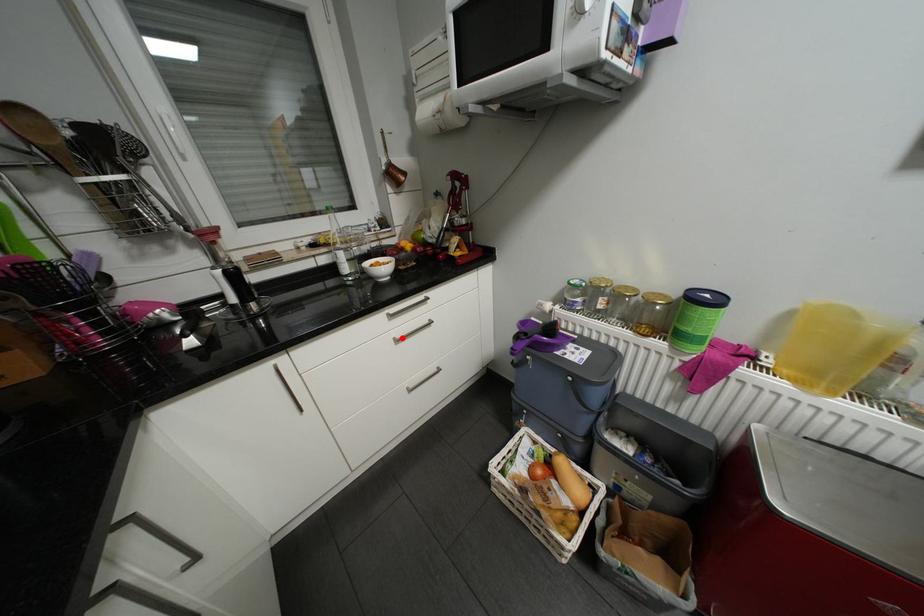
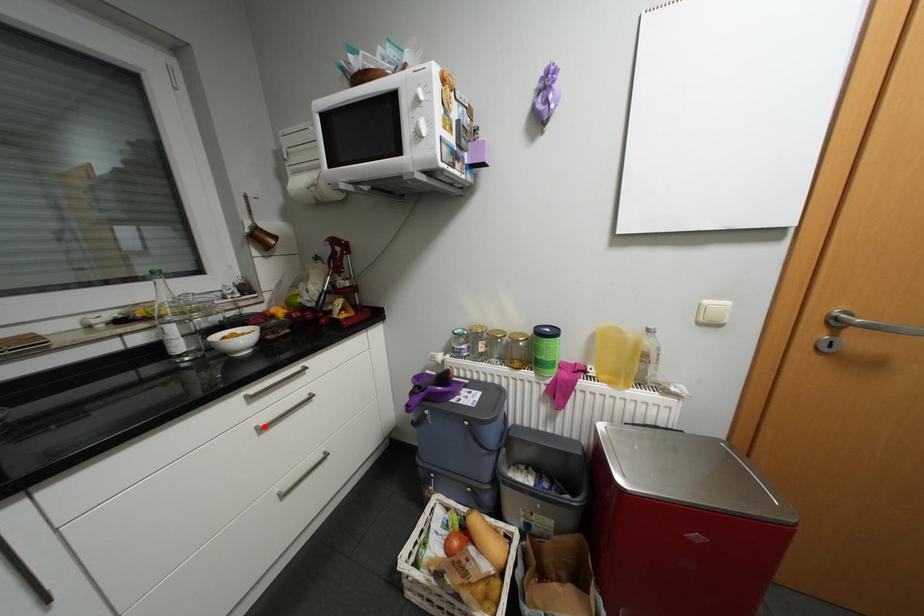
I am providing you with two images of the same scene from different viewpoints. A red point is marked on the first image and another point is marked on the second image. Is the red point in image1 aligned with the point shown in image2?

Yes